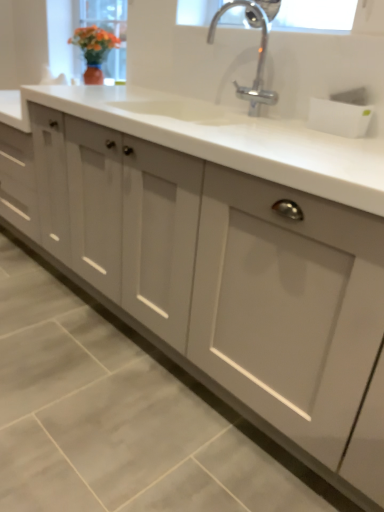
In order to face chrome metallic faucet at upper center, should I rotate leftwards or rightwards?

Rotate your view right by about 6.581°.

Identify the location of chrome metallic faucet at upper center. (258, 50).

This screenshot has height=512, width=384. What do you see at coordinates (258, 50) in the screenshot?
I see `chrome metallic faucet at upper center` at bounding box center [258, 50].

Where is `clear glass window screen at upper center`? This screenshot has height=512, width=384. clear glass window screen at upper center is located at coordinates (316, 16).

What do you see at coordinates (316, 16) in the screenshot? I see `clear glass window screen at upper center` at bounding box center [316, 16].

What are the coordinates of `chrome metallic faucet at upper center` in the screenshot? It's located at (258, 50).

In the image, is chrome metallic faucet at upper center on the left side or the right side of clear glass window screen at upper center?

chrome metallic faucet at upper center is to the left of clear glass window screen at upper center.

Which object is closer to the camera taking this photo, chrome metallic faucet at upper center or clear glass window screen at upper center?

chrome metallic faucet at upper center is in front.

Between point (265, 30) and point (301, 29), which one is positioned behind?

The point (265, 30) is farther from the camera.

From the image's perspective, does chrome metallic faucet at upper center appear higher than clear glass window screen at upper center?

No, from the image's perspective, chrome metallic faucet at upper center is not on top of clear glass window screen at upper center.

From a real-world perspective, is chrome metallic faucet at upper center beneath clear glass window screen at upper center?

Yes, from a real-world perspective, chrome metallic faucet at upper center is below clear glass window screen at upper center.

Considering the relative sizes of chrome metallic faucet at upper center and clear glass window screen at upper center in the image provided, is chrome metallic faucet at upper center thinner than clear glass window screen at upper center?

Correct, the width of chrome metallic faucet at upper center is less than that of clear glass window screen at upper center.

Can you confirm if chrome metallic faucet at upper center is taller than clear glass window screen at upper center?

Indeed, chrome metallic faucet at upper center has a greater height compared to clear glass window screen at upper center.

Looking at this image, considering the sizes of chrome metallic faucet at upper center and clear glass window screen at upper center in the image, is chrome metallic faucet at upper center bigger or smaller than clear glass window screen at upper center?

Considering their sizes, chrome metallic faucet at upper center takes up more space than clear glass window screen at upper center.

Choose the correct answer: Is chrome metallic faucet at upper center inside clear glass window screen at upper center or outside it?

chrome metallic faucet at upper center cannot be found inside clear glass window screen at upper center.

Is chrome metallic faucet at upper center not close to clear glass window screen at upper center?

No, chrome metallic faucet at upper center is in close proximity to clear glass window screen at upper center.

Is chrome metallic faucet at upper center turned away from clear glass window screen at upper center?

Absolutely, chrome metallic faucet at upper center is directed away from clear glass window screen at upper center.

Locate an element on the screen. The width and height of the screenshot is (384, 512). window screen behind the chrome metallic faucet at upper center is located at coordinates pyautogui.click(x=316, y=16).

Does clear glass window screen at upper center appear on the left side of chrome metallic faucet at upper center?

In fact, clear glass window screen at upper center is to the right of chrome metallic faucet at upper center.

Relative to chrome metallic faucet at upper center, is clear glass window screen at upper center in front or behind?

Result: In the image, clear glass window screen at upper center appears behind chrome metallic faucet at upper center.

Is point (248, 24) closer or farther from the camera than point (266, 94)?

Point (248, 24).

From the image's perspective, which one is positioned lower, clear glass window screen at upper center or chrome metallic faucet at upper center?

chrome metallic faucet at upper center, from the image's perspective.

From a real-world perspective, is clear glass window screen at upper center physically below chrome metallic faucet at upper center?

No, from a real-world perspective, clear glass window screen at upper center is not under chrome metallic faucet at upper center.

Is clear glass window screen at upper center wider than chrome metallic faucet at upper center?

Correct, the width of clear glass window screen at upper center exceeds that of chrome metallic faucet at upper center.

From the picture: Which of these two, clear glass window screen at upper center or chrome metallic faucet at upper center, stands taller?

Standing taller between the two is chrome metallic faucet at upper center.

Based on their sizes in the image, would you say clear glass window screen at upper center is bigger or smaller than chrome metallic faucet at upper center?

Clearly, clear glass window screen at upper center is smaller in size than chrome metallic faucet at upper center.

Is clear glass window screen at upper center located outside chrome metallic faucet at upper center?

Yes, clear glass window screen at upper center is outside of chrome metallic faucet at upper center.

Is clear glass window screen at upper center not near chrome metallic faucet at upper center?

clear glass window screen at upper center is actually quite close to chrome metallic faucet at upper center.

Does clear glass window screen at upper center turn towards chrome metallic faucet at upper center?

Yes, clear glass window screen at upper center is aimed at chrome metallic faucet at upper center.

How distant is clear glass window screen at upper center from chrome metallic faucet at upper center?

A distance of 5.06 inches exists between clear glass window screen at upper center and chrome metallic faucet at upper center.

At what (x,y) coordinates should I click in order to perform the action: click on window screen behind the chrome metallic faucet at upper center. Please return your answer as a coordinate pair (x, y). Image resolution: width=384 pixels, height=512 pixels. Looking at the image, I should click on (316, 16).

Where is `tap that is below the clear glass window screen at upper center (from the image's perspective)`? Image resolution: width=384 pixels, height=512 pixels. tap that is below the clear glass window screen at upper center (from the image's perspective) is located at coordinates (258, 50).

The height and width of the screenshot is (512, 384). I want to click on tap directly beneath the clear glass window screen at upper center (from a real-world perspective), so click(x=258, y=50).